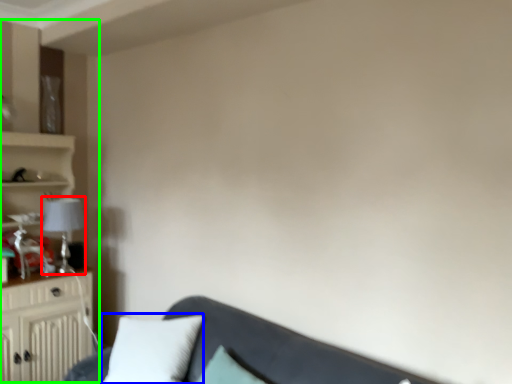
Question: Which object is positioned farthest from lamp (highlighted by a red box)? Select from pillow (highlighted by a blue box) and entertainment center (highlighted by a green box).

Choices:
 (A) pillow
 (B) entertainment center

Answer: (A)